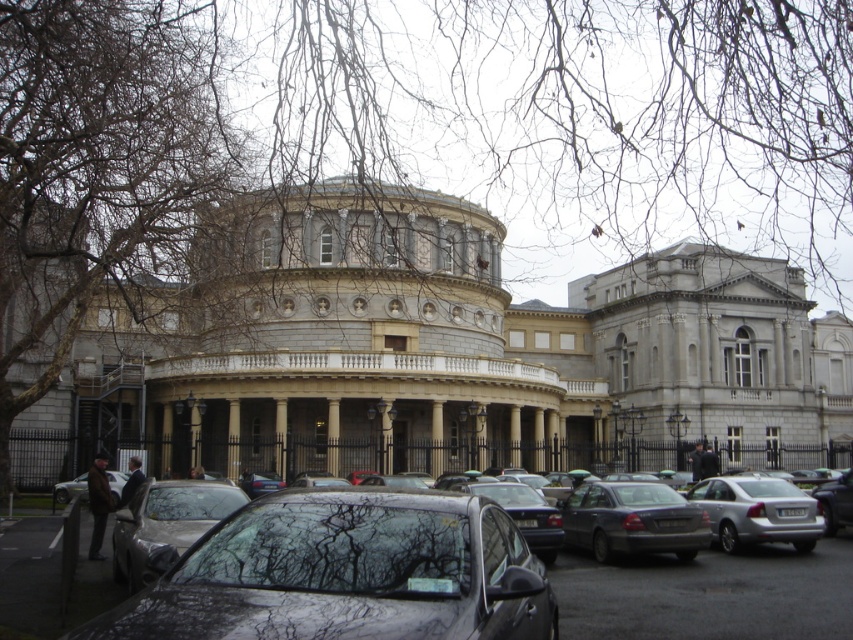
Question: Which of the following is the closest to the observer?

Choices:
 (A) shiny black sedan at center
 (B) gray stone palace at center
 (C) silver metallic car at lower left
 (D) shiny silver car at center

Answer: (A)

Question: Does shiny black sedan at center appear under silver metallic car at lower left?

Choices:
 (A) yes
 (B) no

Answer: (B)

Question: Is shiny silver car at center below silver metallic car at lower left?

Choices:
 (A) no
 (B) yes

Answer: (A)

Question: Among these objects, which one is farthest from the camera?

Choices:
 (A) silver metallic sedan at lower right
 (B) matte gray sedan at center
 (C) shiny black sedan at center

Answer: (A)

Question: Is matte gray sedan at center in front of shiny silver car at center?

Choices:
 (A) yes
 (B) no

Answer: (B)

Question: Which point is farther from the camera taking this photo?

Choices:
 (A) (178, 531)
 (B) (708, 522)

Answer: (B)